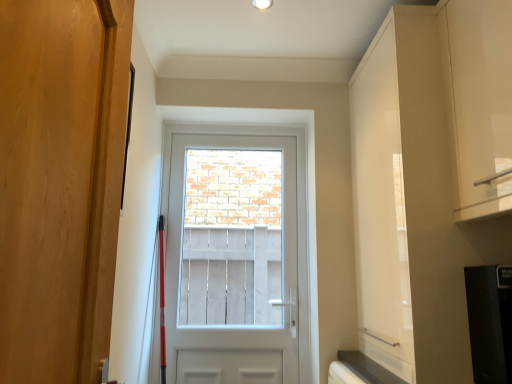
Question: From the image's perspective, is white glossy door at center, the first door from the back, positioned above or below white glossy cabinet at upper right?

Choices:
 (A) above
 (B) below

Answer: (B)

Question: Do you think white glossy door at center, the second door from the front, is within white glossy cabinet at upper right, or outside of it?

Choices:
 (A) outside
 (B) inside

Answer: (A)

Question: Which object is the farthest from the black matte refrigerator at lower right?

Choices:
 (A) white glossy cabinet at upper right
 (B) white glossy door at center, the first door from the back
 (C) white glossy cabinet at upper right
 (D) wooden door at left, positioned as the 1th door in front-to-back order
 (E) white wooden screen at center

Answer: (E)

Question: Based on their relative distances, which object is nearer to the white glossy cabinet at upper right?

Choices:
 (A) wooden door at left, positioned as the 1th door in front-to-back order
 (B) white glossy door at center, the second door from the front
 (C) white wooden screen at center
 (D) black matte refrigerator at lower right
 (E) white glossy cabinet at upper right

Answer: (E)